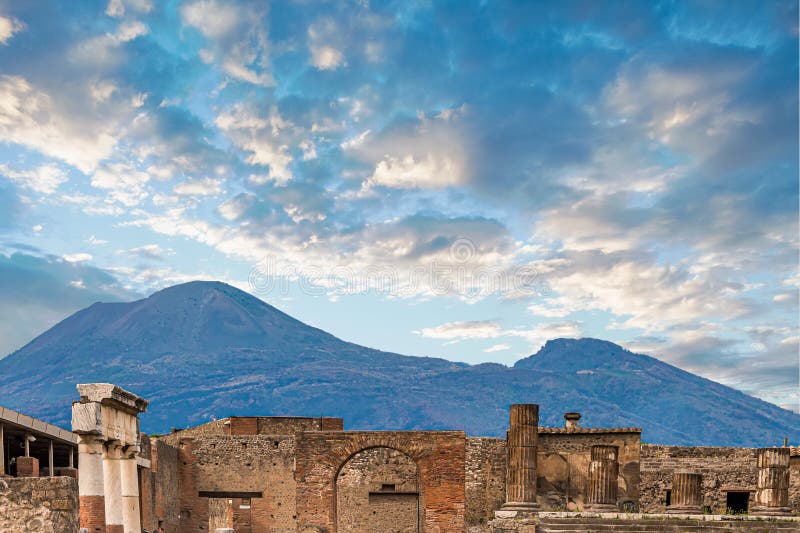
At what (x,y) coordinates should I click in order to perform the action: click on pillar. Please return your answer as a coordinate pair (x, y). This screenshot has width=800, height=533. Looking at the image, I should click on (132, 483).